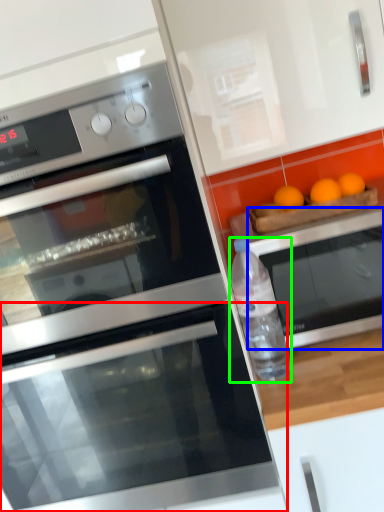
Question: Which object is positioned farthest from oven (highlighted by a red box)? Select from oven (highlighted by a blue box) and bottle (highlighted by a green box).

Choices:
 (A) oven
 (B) bottle

Answer: (A)